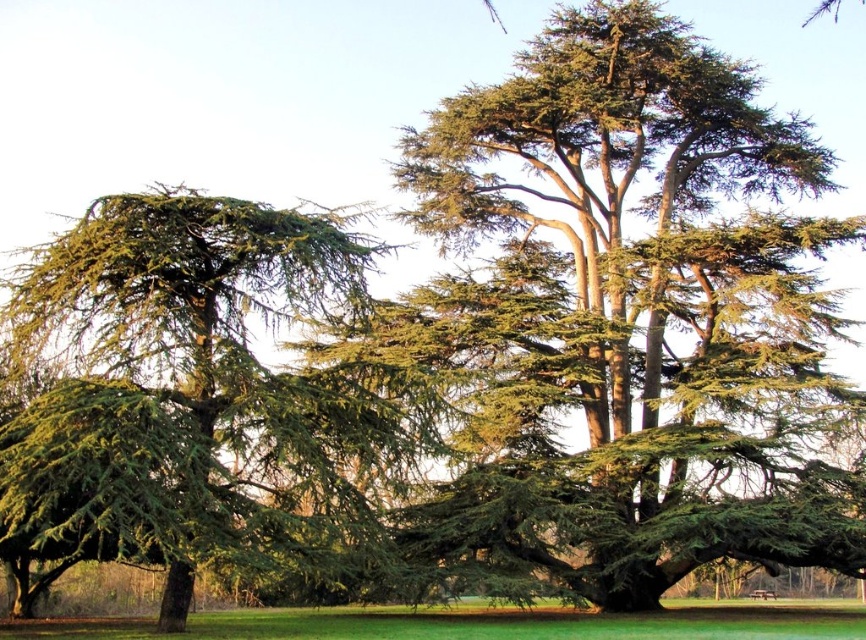
Which is more to the left, green grass at lower center or wooden park bench at center?

green grass at lower center is more to the left.

Is point (26, 636) positioned behind point (776, 595)?

No, it is in front of (776, 595).

Describe the element at coordinates (483, 624) in the screenshot. The image size is (866, 640). I see `green grass at lower center` at that location.

You are a GUI agent. You are given a task and a screenshot of the screen. Output one action in this format:
    pyautogui.click(x=<x>, y=<y>)
    Task: Click on the green grass at lower center
    The width and height of the screenshot is (866, 640).
    Given the screenshot: What is the action you would take?
    pyautogui.click(x=483, y=624)

Which is in front, point (669, 284) or point (532, 634)?

Positioned in front is point (532, 634).

Between green needle-like foliage at center and green grass at lower center, which one is positioned lower?

green grass at lower center is below.

Does point (740, 86) come closer to viewer compared to point (289, 625)?

No, it is behind (289, 625).

Where is `green needle-like foliage at center`? The width and height of the screenshot is (866, 640). green needle-like foliage at center is located at coordinates (648, 300).

Who is positioned more to the left, green needle-like foliage at center or green needle-like at left?

green needle-like at left is more to the left.

From the picture: Who is positioned more to the right, green needle-like foliage at center or green needle-like at left?

From the viewer's perspective, green needle-like foliage at center appears more on the right side.

Is point (805, 548) positioned behind point (220, 541)?

Yes, it is.

Locate an element on the screen. This screenshot has width=866, height=640. green needle-like foliage at center is located at coordinates (648, 300).